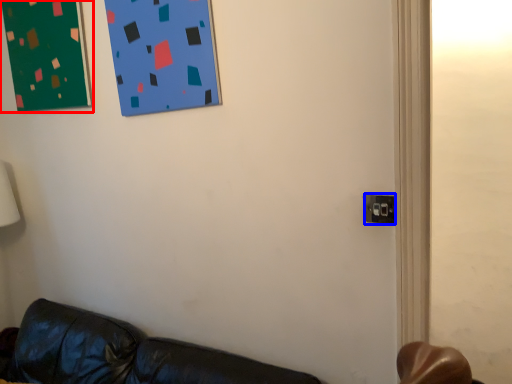
Question: Which object is closer to the camera taking this photo, bulletin board (highlighted by a red box) or electric outlet (highlighted by a blue box)?

Choices:
 (A) bulletin board
 (B) electric outlet

Answer: (B)